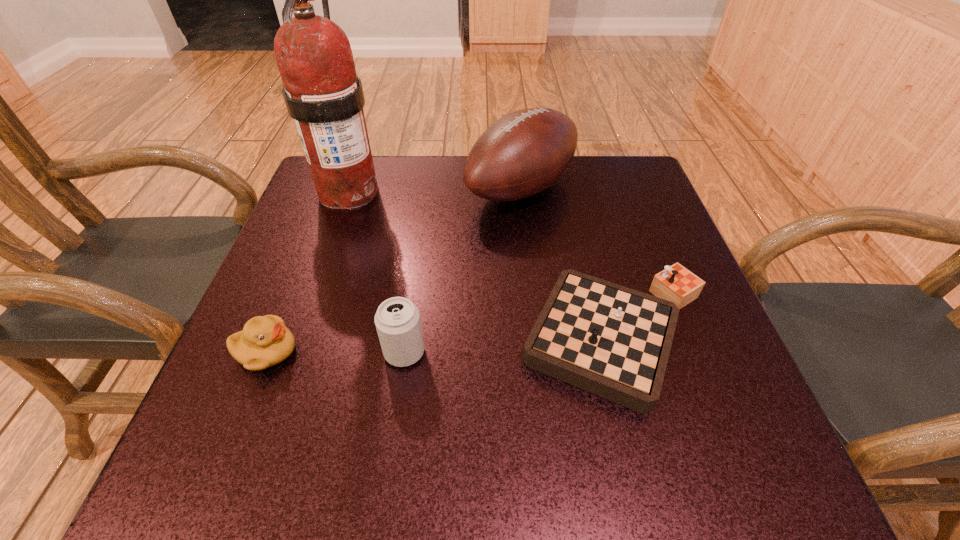
You are a GUI agent. You are given a task and a screenshot of the screen. Output one action in this format:
    pyautogui.click(x=<x>, y=<y>)
    Task: Click on the vacant region at the right edge of the desktop
    
    Given the screenshot: What is the action you would take?
    pyautogui.click(x=675, y=354)

I want to click on free space at the near left corner, so click(x=197, y=442).

At what (x,y) coordinates should I click in order to perform the action: click on vacant space at the far right corner of the desktop. Please return your answer as a coordinate pair (x, y). The height and width of the screenshot is (540, 960). Looking at the image, I should click on (630, 165).

Where is `empty location between the fourth shortest object and the third object from right to left`? Image resolution: width=960 pixels, height=540 pixels. empty location between the fourth shortest object and the third object from right to left is located at coordinates (463, 271).

Identify the location of empty space between the third object from right to left and the tallest object. (376, 272).

Image resolution: width=960 pixels, height=540 pixels. Identify the location of vacant region between the football (American) and the tallest object. (435, 190).

You are a GUI agent. You are given a task and a screenshot of the screen. Output one action in this format:
    pyautogui.click(x=<x>, y=<y>)
    Task: Click on the unoccupied position between the football (American) and the tallest object
    
    Given the screenshot: What is the action you would take?
    pyautogui.click(x=435, y=190)

The width and height of the screenshot is (960, 540). Identify the location of empty space that is in between the third object from right to left and the fire extinguisher. (376, 272).

The image size is (960, 540). Identify the location of free area in between the duckling and the third shortest object. (335, 352).

At what (x,y) coordinates should I click in order to perform the action: click on vacant space that's between the tallest object and the third tallest object. Please return your answer as a coordinate pair (x, y). Looking at the image, I should click on (376, 272).